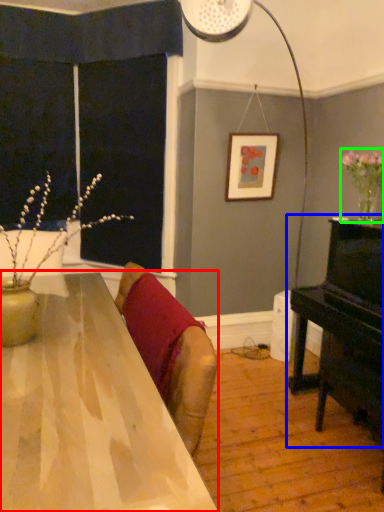
Question: Considering the real-world distances, which object is closest to table (highlighted by a red box)? piano (highlighted by a blue box) or floral arrangement (highlighted by a green box).

Choices:
 (A) piano
 (B) floral arrangement

Answer: (A)